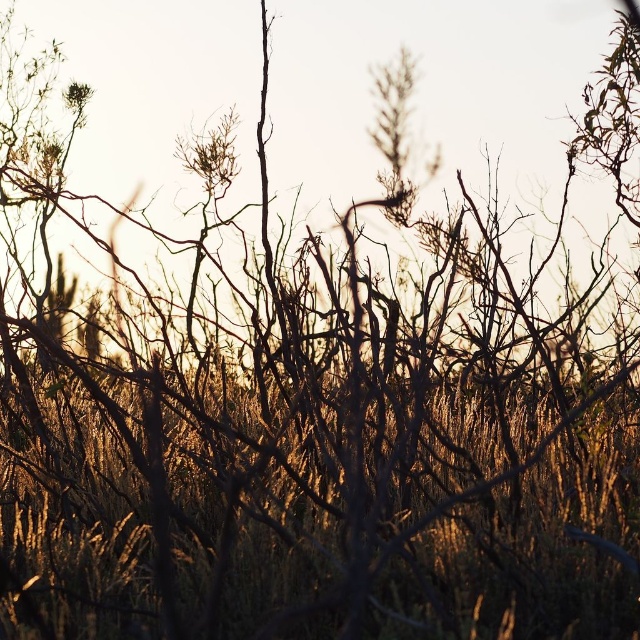
You are a small bird looking for a place to perch. You see the brown dry grass at center and the brown dry branch at upper center. Which one is larger and would provide a more stable perch?

The brown dry grass at center is bigger than the brown dry branch at upper center, so it would provide a more stable perch.

You are a small bird with a wingspan of 1 meter. You want to fly from the brown dry branch at upper center to the green matte flower at upper left. Can you make the flight without flapping your wings, relying only on gliding? Assume you can glide 1 meter for every 2 meters of vertical drop.

The distance between the brown dry branch at upper center and the green matte flower at upper left is 3.51 meters. Since your wingspan is 1 meter, you can glide 1 meter for every 2 meters of vertical drop. To cover 3.51 meters horizontally, you would need a vertical drop of at least 7.02 meters. However, the scene does not provide information about the vertical height difference between the two points. Without knowing the vertical drop, it is impossible to determine if the glide is possible.